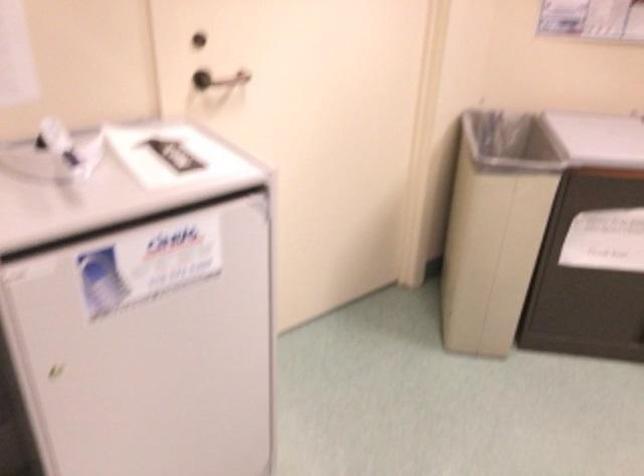
The height and width of the screenshot is (476, 644). In order to click on door lock in this screenshot , I will do `click(199, 40)`.